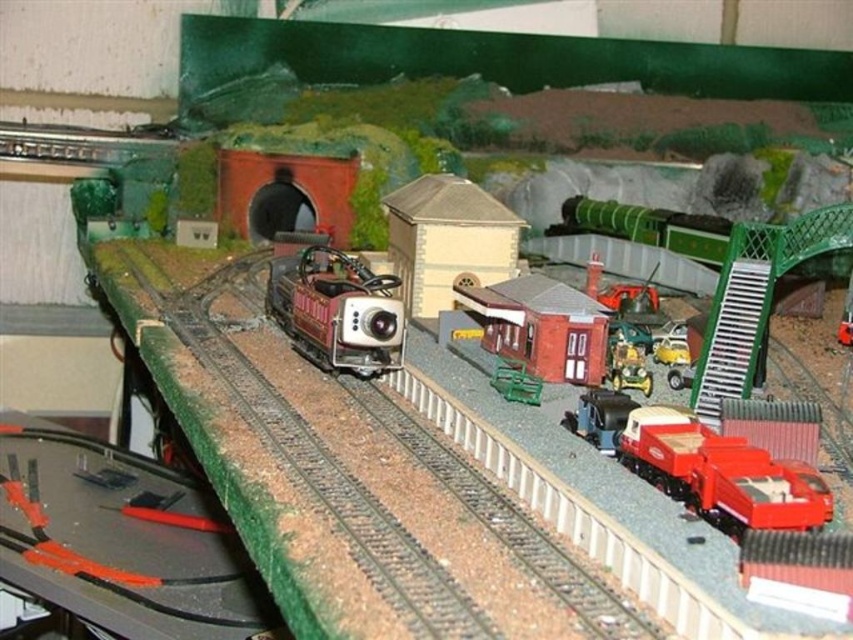
Question: Considering the relative positions of metallic yellow truck at center-right and green plastic bench at center in the image provided, where is metallic yellow truck at center-right located with respect to green plastic bench at center?

Choices:
 (A) below
 (B) above

Answer: (B)

Question: Which of the following is the farthest from the observer?

Choices:
 (A) (625, 369)
 (B) (381, 296)

Answer: (A)

Question: Is metallic yellow truck at center-right positioned before green plastic bench at center?

Choices:
 (A) yes
 (B) no

Answer: (B)

Question: Which of the following is the farthest from the observer?

Choices:
 (A) (592, 444)
 (B) (341, 275)

Answer: (B)

Question: Can you confirm if metallic red truck at lower right is positioned to the right of metallic yellow truck at center-right?

Choices:
 (A) yes
 (B) no

Answer: (B)

Question: Which point appears farthest from the camera in this image?

Choices:
 (A) (540, 380)
 (B) (306, 340)
 (C) (585, 396)

Answer: (B)